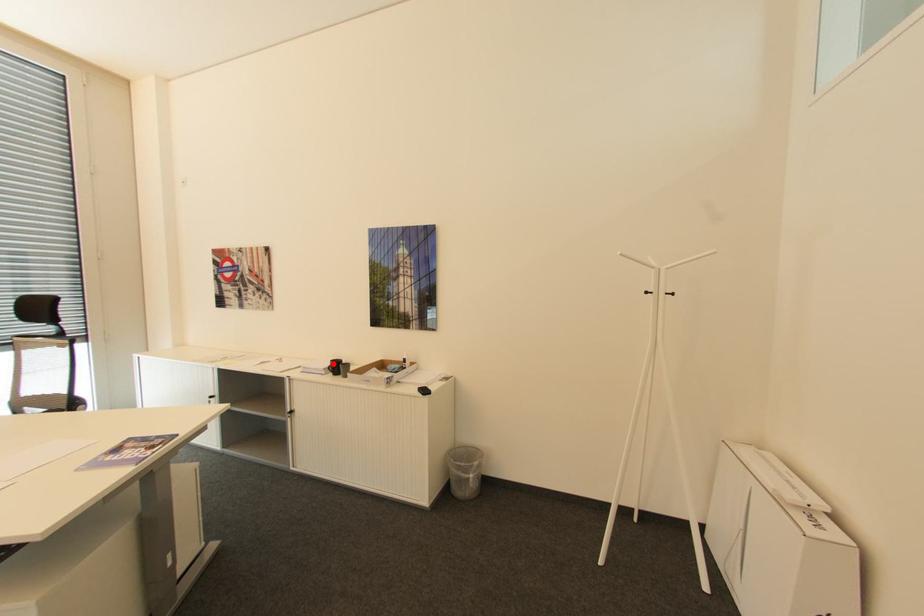
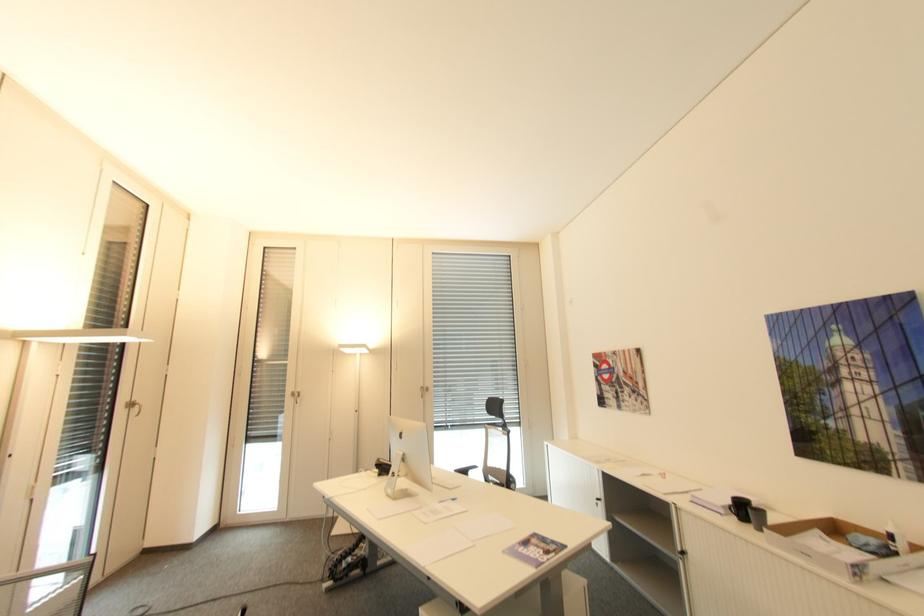
Locate, in the second image, the point that corresponds to the highlighted location in the first image.

(734, 501)